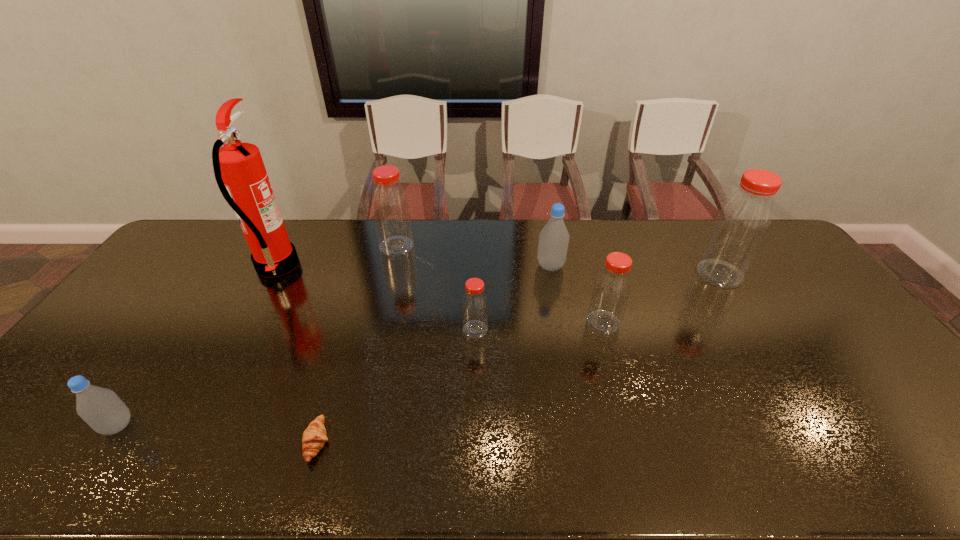
Find the location of a particular element. The image size is (960, 540). free space located on the front of the smallest red bottle is located at coordinates 474,401.

Identify the location of vacant space located on the back of the nearest bottle. This screenshot has height=540, width=960. (174, 343).

Locate an element on the screen. blank space located 0.180m on the front-facing side of the shortest object is located at coordinates (407, 442).

Locate an element on the screen. fire extinguisher that is at the far edge is located at coordinates (239, 170).

Locate an element on the screen. The height and width of the screenshot is (540, 960). object that is at the near edge is located at coordinates (314, 437).

Identify the location of free space at the far edge of the desktop. (590, 228).

Locate an element on the screen. free region at the left edge of the desktop is located at coordinates [164, 273].

At what (x,y) coordinates should I click in order to perform the action: click on free space at the right edge of the desktop. Please return your answer as a coordinate pair (x, y). The image size is (960, 540). Looking at the image, I should click on (806, 272).

At what (x,y) coordinates should I click in order to perform the action: click on vacant space at the near left corner of the desktop. Please return your answer as a coordinate pair (x, y). Image resolution: width=960 pixels, height=540 pixels. Looking at the image, I should click on (13, 463).

I want to click on free space at the near right corner, so click(904, 456).